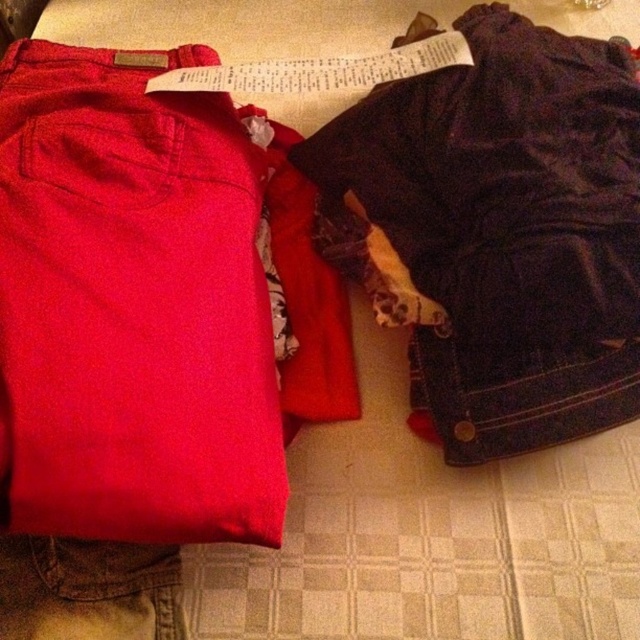
Who is taller, matte cotton pants at left or dark blue corduroy shorts at right?

dark blue corduroy shorts at right is taller.

Who is more distant from viewer, (83, 310) or (374, 108)?

Positioned behind is point (374, 108).

This screenshot has width=640, height=640. Describe the element at coordinates (132, 305) in the screenshot. I see `matte cotton pants at left` at that location.

Locate an element on the screen. This screenshot has height=640, width=640. matte cotton pants at left is located at coordinates (132, 305).